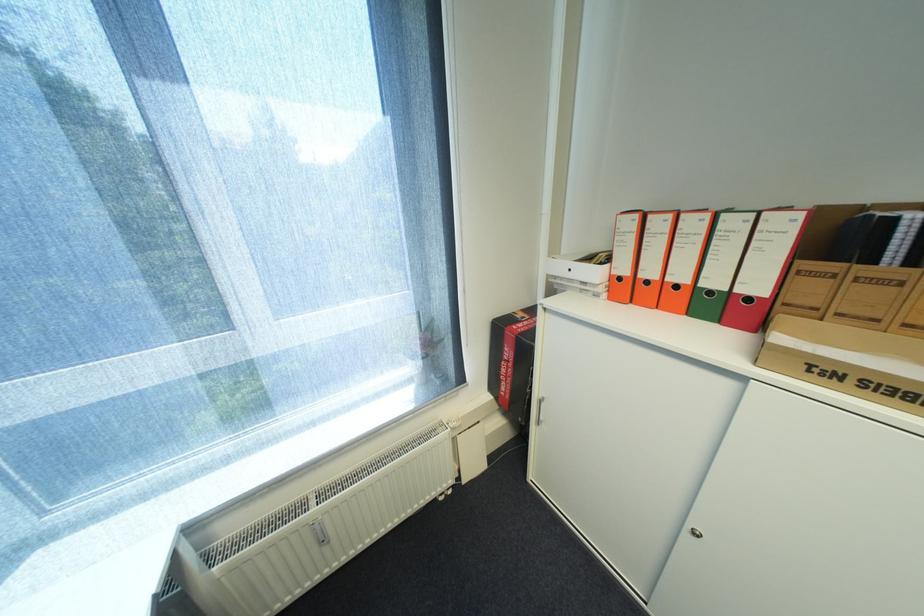
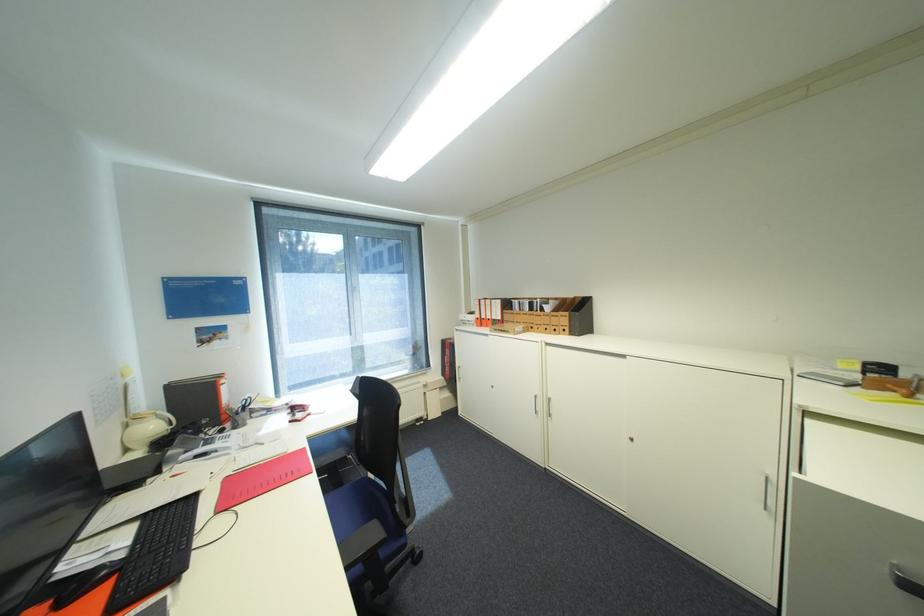
Locate, in the second image, the point that corresponds to pixel 627 278 in the first image.

(485, 318)